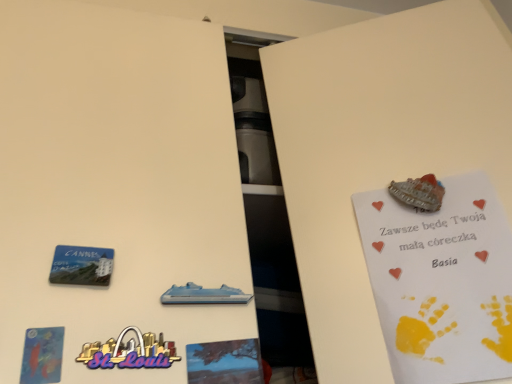
Question: From the image's perspective, is white paper postcard at upper right, which is the 1th postcard in back-to-front order, above or below blue plastic magnet at lower left?

Choices:
 (A) below
 (B) above

Answer: (A)

Question: Considering the positions of white paper postcard at upper right, which is the 1th postcard in back-to-front order, and blue plastic magnet at lower left in the image, is white paper postcard at upper right, which is the 1th postcard in back-to-front order, taller or shorter than blue plastic magnet at lower left?

Choices:
 (A) short
 (B) tall

Answer: (B)

Question: Estimate the real-world distances between objects in this image. Which object is farther from the white paper postcard at upper right, positioned as the second postcard in left-to-right order?

Choices:
 (A) blue plastic cruise ship at center
 (B) matte blue postcard at lower left, acting as the second postcard starting from the right
 (C) blue plastic magnet at lower left
 (D) blue matte tree at center

Answer: (B)

Question: Considering the real-world distances, which object is farthest from the blue plastic magnet at lower left?

Choices:
 (A) blue plastic cruise ship at center
 (B) blue matte tree at center
 (C) white paper postcard at upper right, positioned as the second postcard in left-to-right order
 (D) matte blue postcard at lower left, placed as the second postcard when sorted from back to front

Answer: (C)